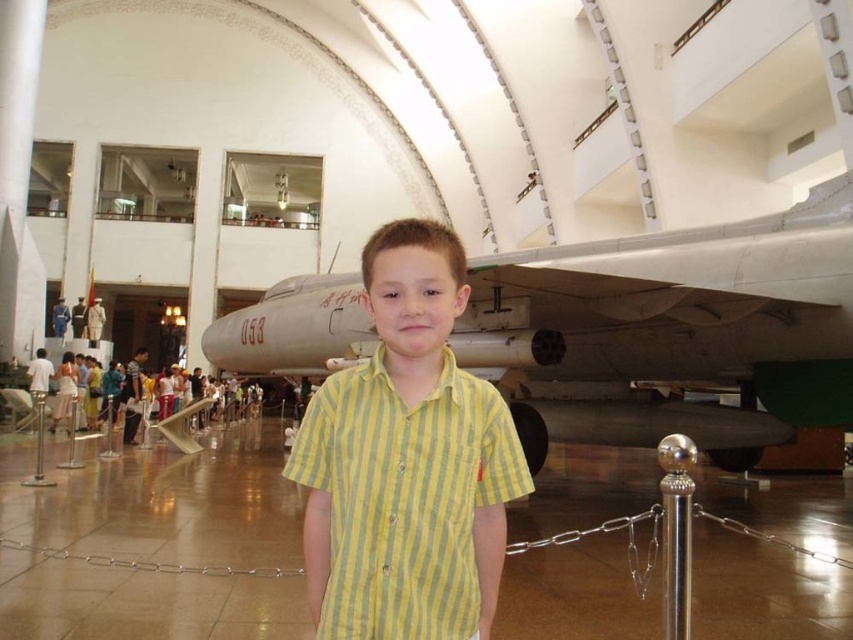
You are a tour guide leading a group in the museum. You need to ensure that visitors maintain a minimum distance of 15 meters from the silver metallic airplane at center for safety. A visitor wearing the yellow striped shirt at center is currently standing near the airplane. Is the visitor complying with the safety distance requirement?

The distance between the silver metallic airplane at center and the yellow striped shirt at center is 14.71 meters, which is less than the required 15 meters. Therefore, the visitor is not complying with the safety distance requirement and should move further away.

You are a visitor at the museum and want to take a photo of the silver metallic airplane at center without the yellow striped shirt at center appearing in the shot. Which direction should you move to achieve this?

The silver metallic airplane at center is to the right of the yellow striped shirt at center. To avoid the yellow striped shirt at center in the photo, move to the right side of the shirt so that the airplane is now on the opposite side of the shirt from you.